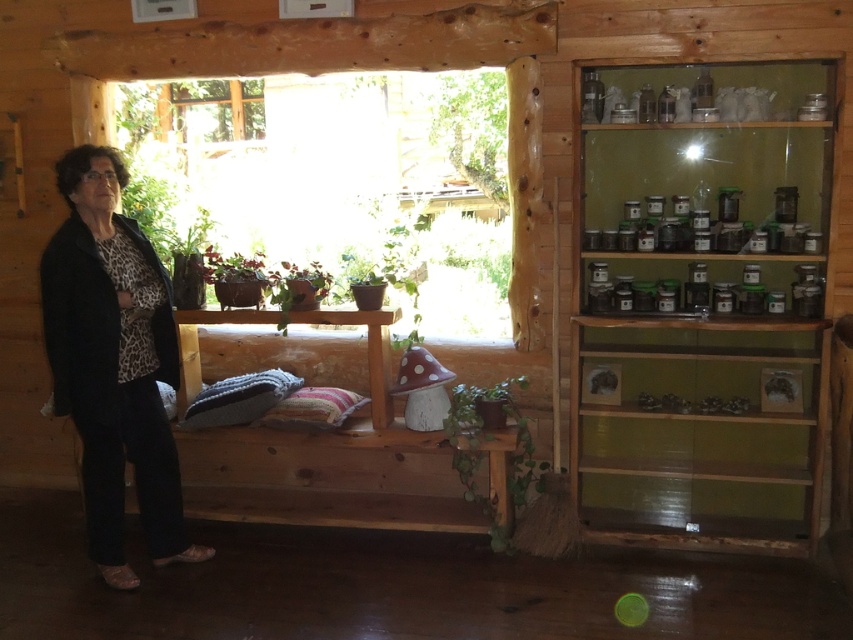
Is clear glass shelves at upper right thinner than green leafy plant at upper center?

In fact, clear glass shelves at upper right might be wider than green leafy plant at upper center.

Who is more forward, (730, 324) or (495, 132)?

Point (730, 324) is more forward.

Is point (753, 550) positioned in front of point (454, 99)?

Yes, point (753, 550) is closer to viewer.

This screenshot has height=640, width=853. I want to click on clear glass shelves at upper right, so click(704, 316).

Looking at this image, can you confirm if transparent glass window at center is smaller than matte brown pot at center?

Incorrect, transparent glass window at center is not smaller in size than matte brown pot at center.

Between point (225, 244) and point (210, 259), which one is positioned behind?

Positioned behind is point (225, 244).

What do you see at coordinates (344, 176) in the screenshot? This screenshot has height=640, width=853. I see `transparent glass window at center` at bounding box center [344, 176].

Identify the location of transparent glass window at center. (344, 176).

Which of these two, leopard print fabric at left or matte brown pot at center, stands shorter?

matte brown pot at center

Does leopard print fabric at left have a larger size compared to matte brown pot at center?

Indeed, leopard print fabric at left has a larger size compared to matte brown pot at center.

I want to click on leopard print fabric at left, so click(113, 362).

The image size is (853, 640). Identify the location of leopard print fabric at left. (113, 362).